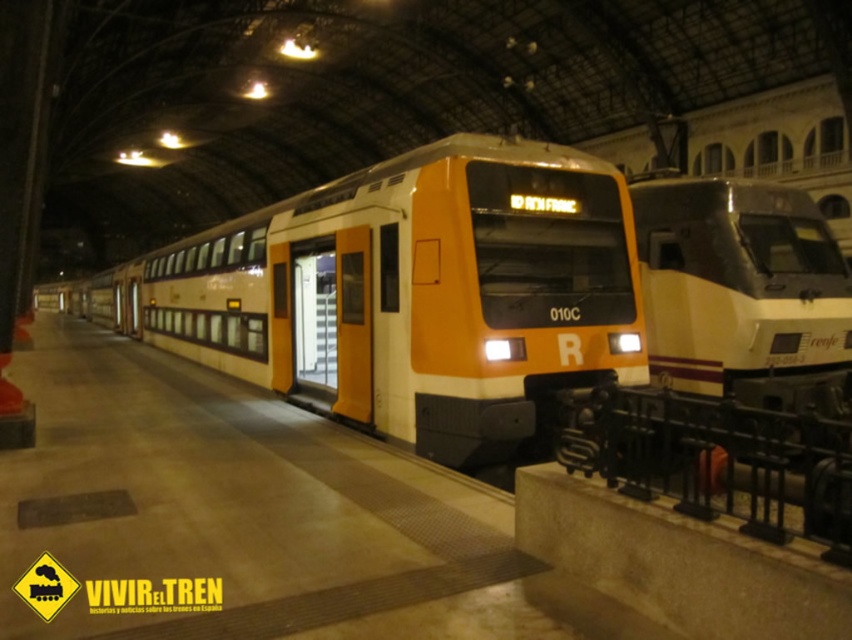
You are a station engineer who needs to ensure safety clearance between the matte orange train at center and the black wrought iron rail at lower right. Based on their sizes, is there enough space for the train to move without hitting the rail?

The matte orange train at center is larger in size than the black wrought iron rail at lower right. Since the train is bigger, there should be sufficient clearance to move without hitting the rail, provided the positioning allows for maneuvering around the rail.

You are a passenger standing on the platform at the train station. You see the matte orange train at center and the matte yellow train at center. Which train is positioned lower in the image?

The matte orange train at center is positioned lower than the matte yellow train at center in the image.

You are standing at point (697,484) and want to walk to point (793,317). Which direction should you move in?

You should move backward to reach point (793,317) because it is located behind point (697,484).